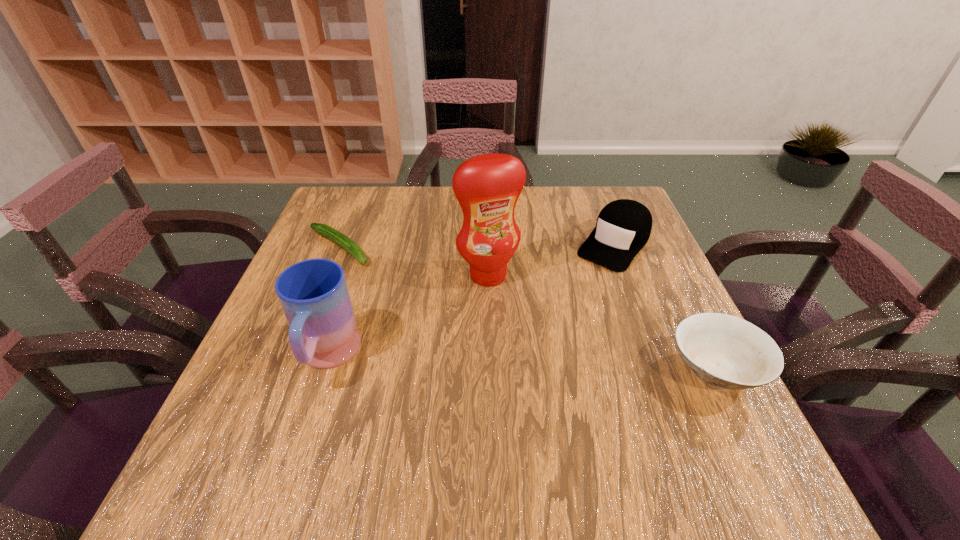
Image resolution: width=960 pixels, height=540 pixels. What are the coordinates of `bowl present at the near edge` in the screenshot? It's located at (725, 351).

Where is `mug situated at the left edge`? Image resolution: width=960 pixels, height=540 pixels. mug situated at the left edge is located at coordinates (313, 293).

Identify the location of zucchini at the left edge. (340, 239).

The height and width of the screenshot is (540, 960). Identify the location of bowl present at the right edge. (725, 351).

The height and width of the screenshot is (540, 960). I want to click on cap present at the right edge, so click(x=623, y=227).

Identify the location of object located at the far left corner. The height and width of the screenshot is (540, 960). (340, 239).

The width and height of the screenshot is (960, 540). Find the location of `object at the near left corner`. object at the near left corner is located at coordinates (313, 293).

The image size is (960, 540). In order to click on object situated at the far right corner in this screenshot , I will do `click(623, 227)`.

Locate an element on the screen. Image resolution: width=960 pixels, height=540 pixels. object at the near right corner is located at coordinates (725, 351).

This screenshot has height=540, width=960. I want to click on blank area at the far edge, so click(547, 217).